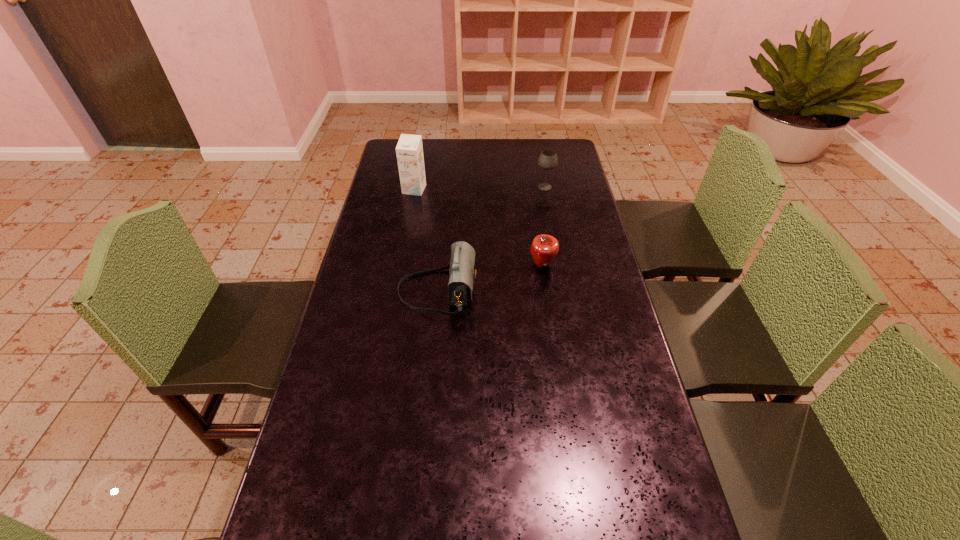
The height and width of the screenshot is (540, 960). Identify the location of carton. (409, 150).

This screenshot has height=540, width=960. In order to click on wineglass in this screenshot , I will do `click(548, 160)`.

Locate an element on the screen. This screenshot has width=960, height=540. shoulder bag is located at coordinates (462, 274).

Locate an element on the screen. This screenshot has width=960, height=540. apple is located at coordinates (544, 248).

In order to click on vacant area situated 0.350m on the back of the carton in this screenshot , I will do `click(423, 141)`.

At what (x,y) coordinates should I click in order to perform the action: click on vacant space located on the left of the wineglass. Please return your answer as a coordinate pair (x, y). The height and width of the screenshot is (540, 960). Looking at the image, I should click on (517, 187).

The width and height of the screenshot is (960, 540). Find the location of `vacant space located on the right of the shoulder bag`. vacant space located on the right of the shoulder bag is located at coordinates click(x=587, y=291).

At what (x,y) coordinates should I click in order to perform the action: click on vacant point located on the front of the apple. Please return your answer as a coordinate pair (x, y). Looking at the image, I should click on (550, 315).

This screenshot has height=540, width=960. I want to click on carton positioned at the left edge, so click(x=409, y=150).

Locate an element on the screen. This screenshot has height=540, width=960. shoulder bag that is positioned at the left edge is located at coordinates (462, 274).